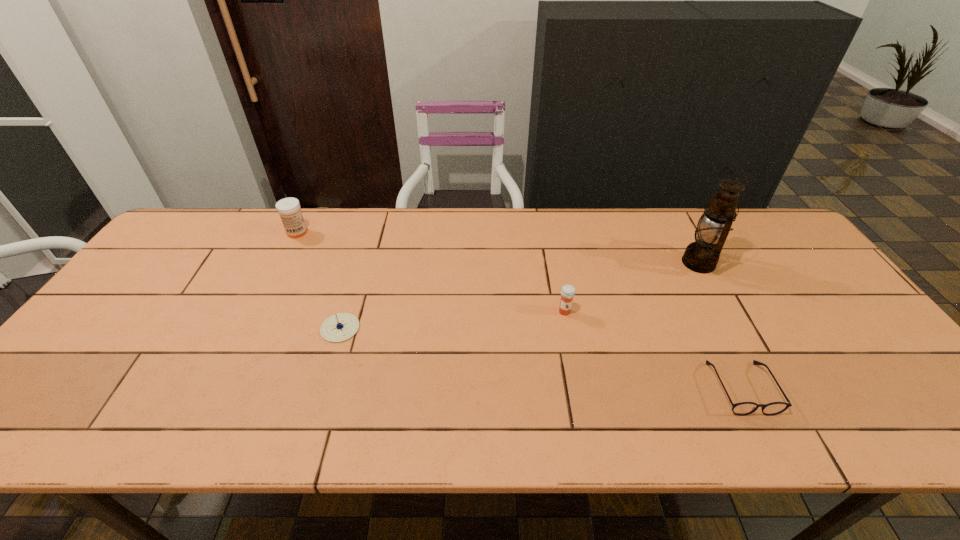
Identify which object is located as the third nearest to the spectacles. Please provide its 2D coordinates. Your answer should be formatted as a tuple, i.e. [(x, y)], where the tuple contains the x and y coordinates of a point satisfying the conditions above.

[(342, 326)]

Locate an element on the screen. the third closest object to the tallest object is located at coordinates (342, 326).